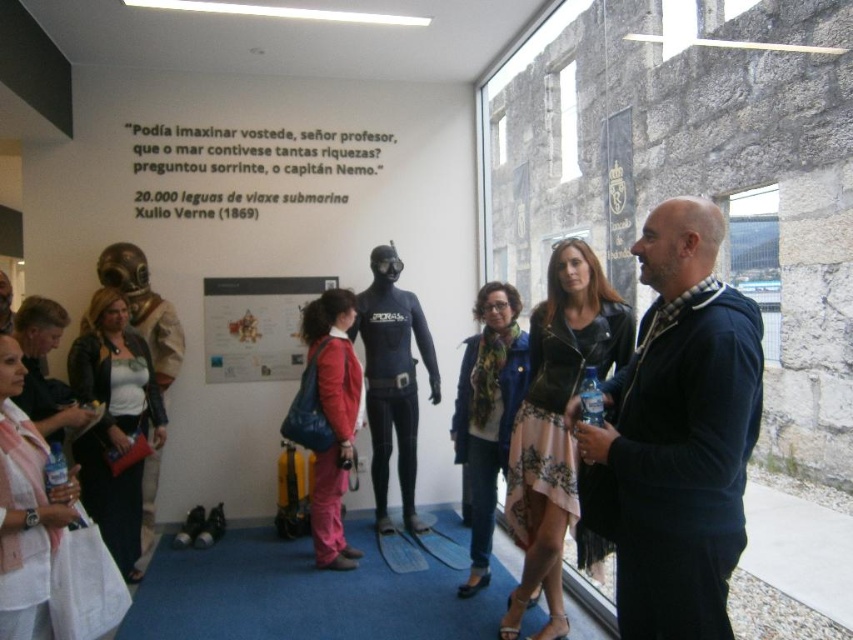
Question: Is the position of leather jacket at center more distant than that of matte black poster at center?

Choices:
 (A) no
 (B) yes

Answer: (A)

Question: Which point appears closest to the camera in this image?

Choices:
 (A) (509, 637)
 (B) (26, 442)
 (C) (405, 378)

Answer: (B)

Question: Does dark blue sweater at center lie behind matte black jacket at center?

Choices:
 (A) no
 (B) yes

Answer: (A)

Question: Which object is positioned closest to the leather jacket at center?

Choices:
 (A) matte black wetsuit at center
 (B) blue textured coat at center

Answer: (B)

Question: Does leather jacket at center lie in front of matte black wetsuit at center?

Choices:
 (A) yes
 (B) no

Answer: (A)

Question: Which point appears farthest from the camera in this image?

Choices:
 (A) (120, 336)
 (B) (566, 381)
 (C) (293, 342)
 (D) (519, 332)

Answer: (C)